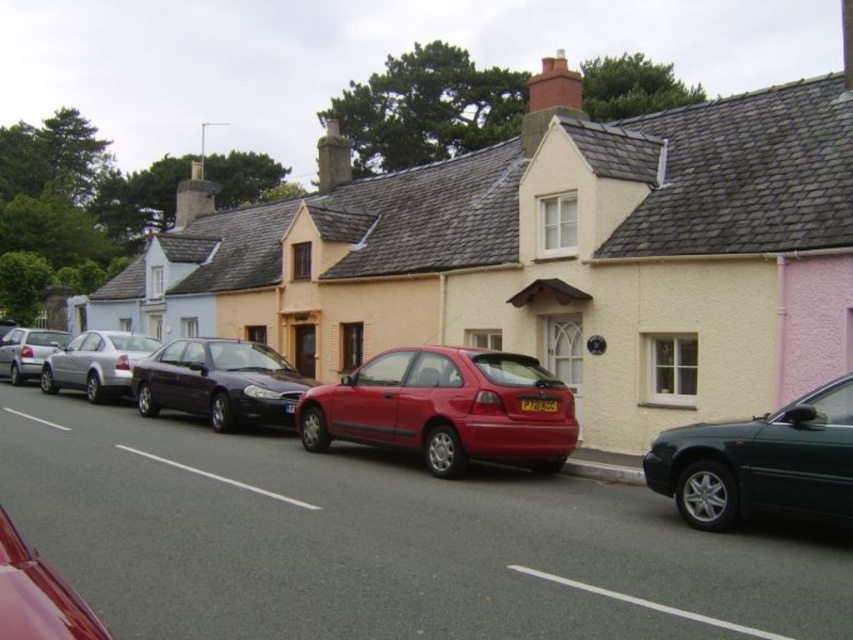
You are standing on the street in front of the row of houses. There are two points marked in the image. The first point is at coordinates point (572, 428) and the second is at point (41, 620). Which point is closer to you?

Point (572, 428) is further to the viewer than point (41, 620), so the second point is closer to you.

In the scene shown: You are a delivery driver who needs to park your vehicle, which is the same size as the silver metallic sedan at center. The parking spot is marked by the white asphalt line at center. Will your vehicle fit within the parking spot?

The silver metallic sedan at center is bigger than the white asphalt line at center, so your vehicle, which is the same size as the silver metallic sedan at center, will not fit within the parking spot marked by the white asphalt line at center.